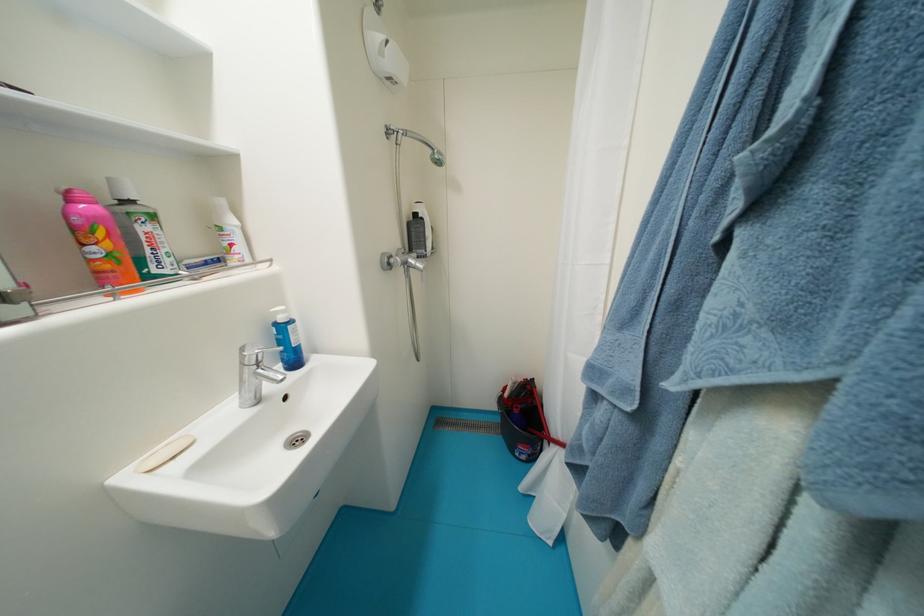
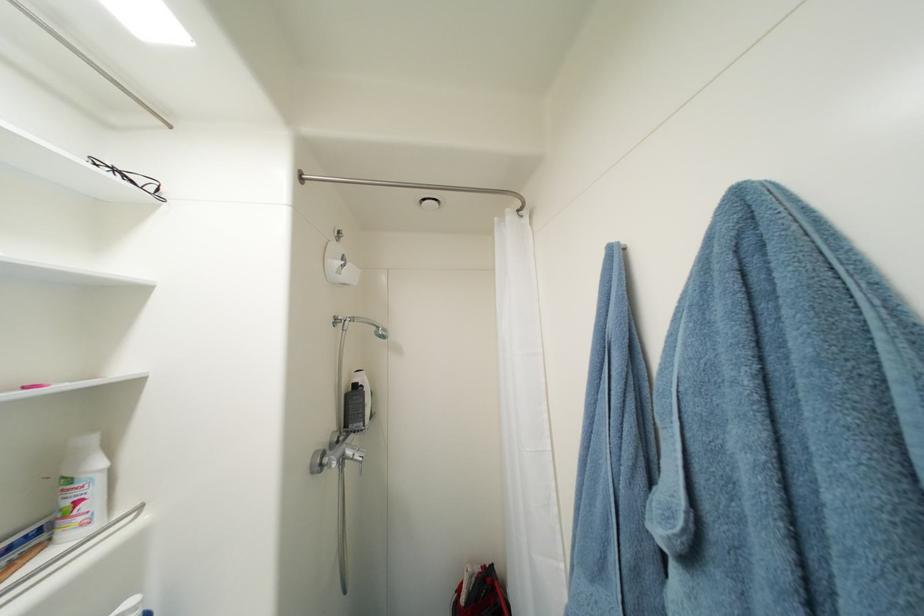
Find the pixel in the second image that matches pixel 418 262 in the first image.

(356, 454)